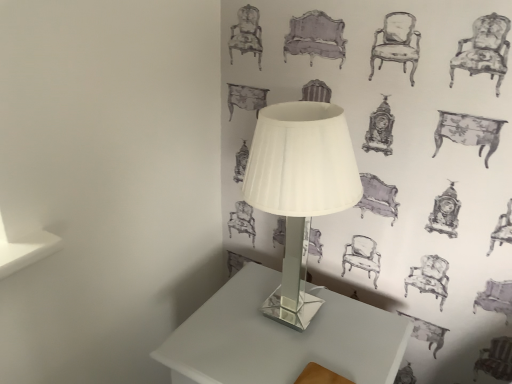
Question: Considering the positions of point (394, 327) and point (294, 147), is point (394, 327) closer or farther from the camera than point (294, 147)?

Choices:
 (A) farther
 (B) closer

Answer: (A)

Question: Is white glossy table at center situated inside white glass lamp at center or outside?

Choices:
 (A) inside
 (B) outside

Answer: (B)

Question: From the image's perspective, is white glossy table at center located above or below white glass lamp at center?

Choices:
 (A) above
 (B) below

Answer: (B)

Question: Would you say white glass lamp at center is inside or outside white glossy table at center?

Choices:
 (A) outside
 (B) inside

Answer: (A)

Question: From the image's perspective, is white glass lamp at center positioned above or below white glossy table at center?

Choices:
 (A) below
 (B) above

Answer: (B)

Question: Considering the positions of white glass lamp at center and white glossy table at center in the image, is white glass lamp at center taller or shorter than white glossy table at center?

Choices:
 (A) short
 (B) tall

Answer: (B)

Question: Is point (340, 185) closer or farther from the camera than point (205, 365)?

Choices:
 (A) closer
 (B) farther

Answer: (A)